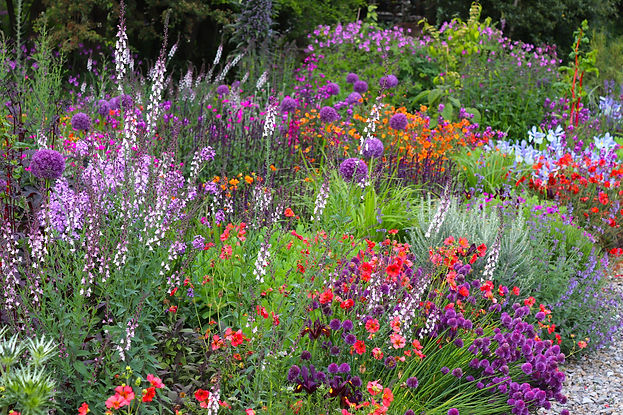
The height and width of the screenshot is (415, 623). In order to click on orange flowers in this screenshot , I will do `click(432, 154)`, `click(359, 127)`, `click(328, 137)`, `click(239, 178)`.